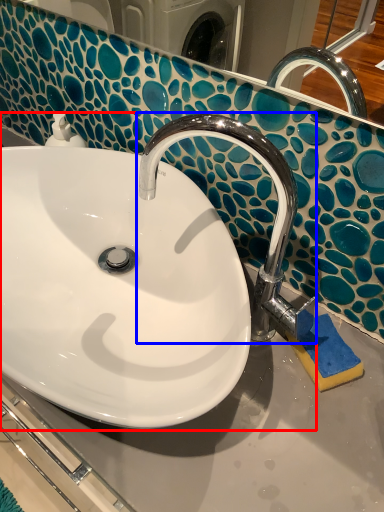
Question: Which object is further to the camera taking this photo, sink (highlighted by a red box) or tap (highlighted by a blue box)?

Choices:
 (A) sink
 (B) tap

Answer: (B)